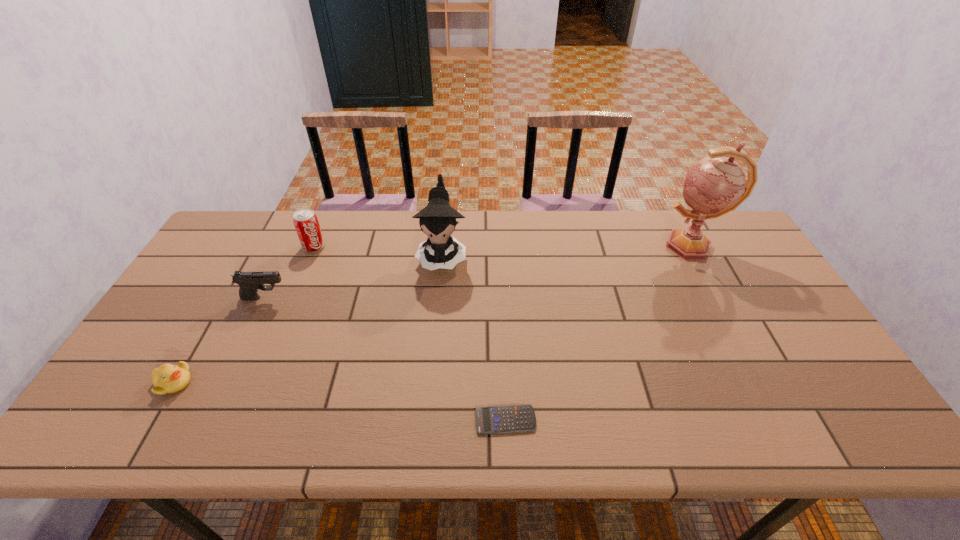
In the image, there is a desktop. What are the coordinates of `vacant region at the far left corner` in the screenshot? It's located at (269, 210).

Find the location of a particular element. The width and height of the screenshot is (960, 540). vacant space at the near left corner of the desktop is located at coordinates (102, 440).

Locate an element on the screen. Image resolution: width=960 pixels, height=540 pixels. free space at the far right corner is located at coordinates (719, 225).

Image resolution: width=960 pixels, height=540 pixels. I want to click on vacant region between the duckling and the third nearest object, so click(x=219, y=340).

This screenshot has width=960, height=540. I want to click on free area in between the doll and the soda can, so click(378, 251).

This screenshot has width=960, height=540. What are the coordinates of `free space between the fourth shortest object and the leftmost object` in the screenshot? It's located at [x=244, y=314].

Locate an element on the screen. This screenshot has height=540, width=960. unoccupied area between the fourth tallest object and the globe is located at coordinates (478, 272).

Locate an element on the screen. free space between the rightmost object and the doll is located at coordinates (566, 251).

In order to click on free space between the shortest object and the leftmost object in this screenshot , I will do pos(340,401).

Where is `free space between the fourth farthest object and the second shortest object`? free space between the fourth farthest object and the second shortest object is located at coordinates (219, 340).